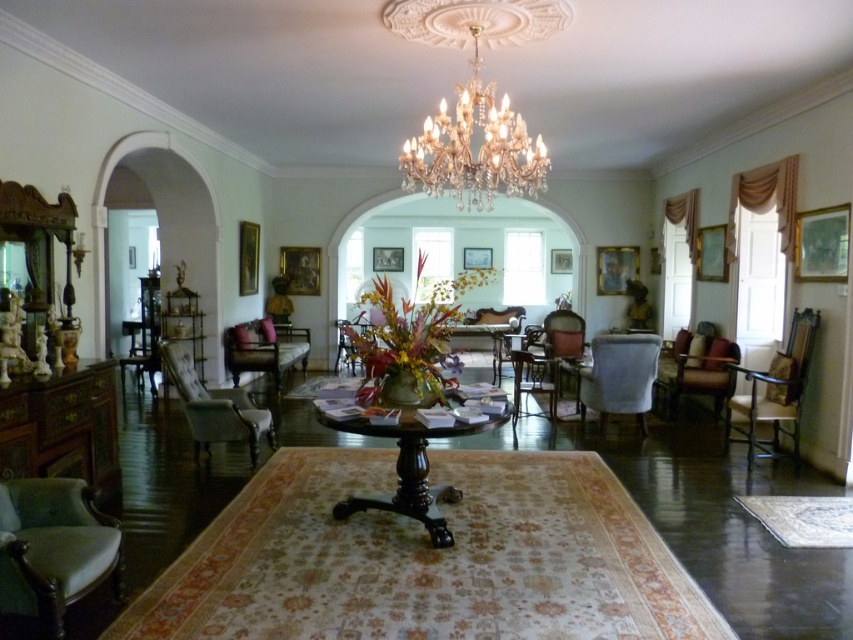
You are standing in the room and want to move from the leather armchair at right to the shiny dark wood table at center. Which direction should you move to reach it?

The shiny dark wood table at center is located below the leather armchair at right, so you should move downward to reach it.